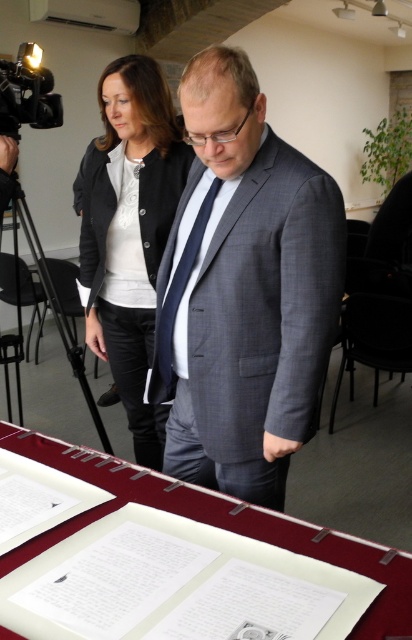
Based on the photo, between matte black blazer at center and dark blue textured tie at center, which one is positioned higher?

matte black blazer at center

The image size is (412, 640). I want to click on matte black blazer at center, so click(128, 230).

I want to click on matte black blazer at center, so click(128, 230).

Can you confirm if gray textured suit at center is positioned to the left of white paper at center?

In fact, gray textured suit at center is to the right of white paper at center.

Can you confirm if gray textured suit at center is positioned to the right of white paper at center?

Indeed, gray textured suit at center is positioned on the right side of white paper at center.

Is point (248, 438) more distant than point (222, 515)?

That is True.

You are a GUI agent. You are given a task and a screenshot of the screen. Output one action in this format:
    pyautogui.click(x=<x>, y=<y>)
    Task: Click on the gray textured suit at center
    
    Given the screenshot: What is the action you would take?
    243,291

Between white paper at center and dark blue textured tie at center, which one is positioned higher?

dark blue textured tie at center is above.

What do you see at coordinates (217, 525) in the screenshot? Image resolution: width=412 pixels, height=640 pixels. I see `white paper at center` at bounding box center [217, 525].

Who is more distant from viewer, (x=49, y=538) or (x=175, y=381)?

Positioned behind is point (x=175, y=381).

Where is `white paper at center`? Image resolution: width=412 pixels, height=640 pixels. white paper at center is located at coordinates (217, 525).